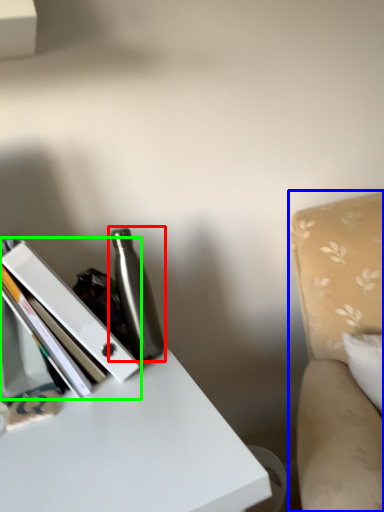
Question: Which is farther away from bottle (highlighted by a red box)? swivel chair (highlighted by a blue box) or book (highlighted by a green box)?

Choices:
 (A) swivel chair
 (B) book

Answer: (A)